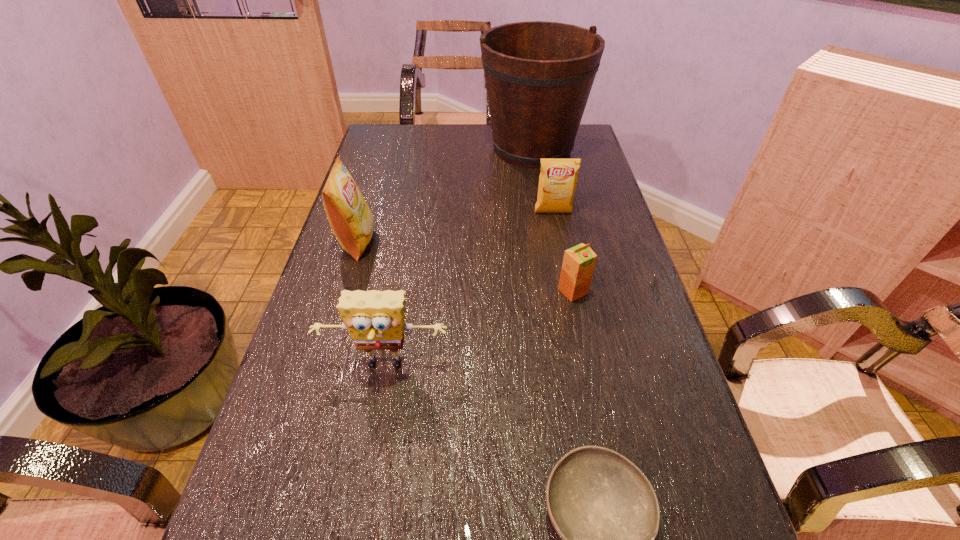
Identify the location of the fifth closest object to the taller crisp (potato chip). (605, 510).

Identify the location of vacant space that satisfies the following two spatial constraints: 1. on the front-facing side of the fourth nearest object; 2. on the left side of the orange juice. (343, 292).

Locate an element on the screen. The image size is (960, 540). free spot that satisfies the following two spatial constraints: 1. on the back side of the orange juice; 2. on the front-facing side of the left crisp (potato chip) is located at coordinates (563, 242).